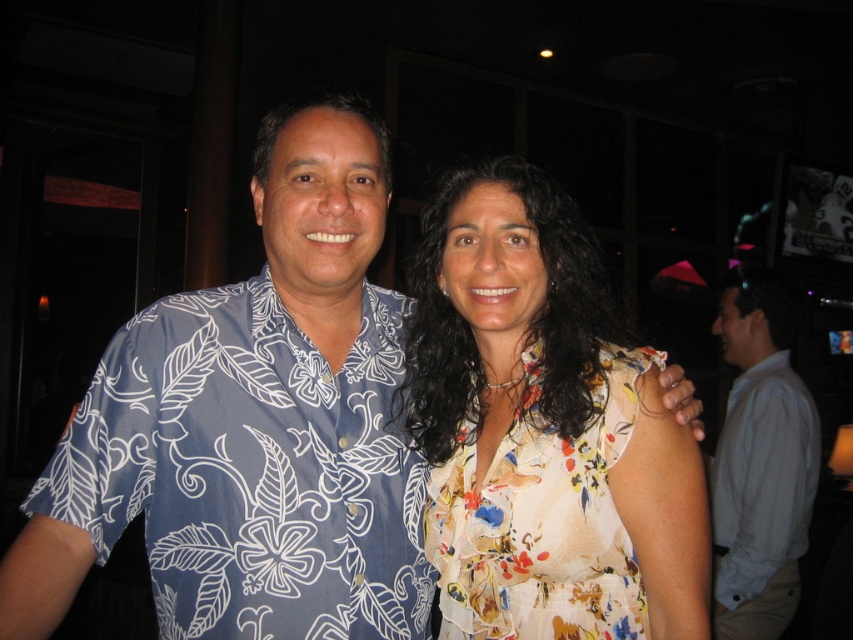
Question: Which object appears closest to the camera in this image?

Choices:
 (A) blue floral-patterned shirt at left
 (B) floral print fabric dress at center
 (C) light blue shirt at right

Answer: (A)

Question: Considering the relative positions of floral print fabric dress at center and light blue shirt at right in the image provided, where is floral print fabric dress at center located with respect to light blue shirt at right?

Choices:
 (A) left
 (B) right

Answer: (A)

Question: Can you confirm if blue floral shirt at center is positioned below blue floral-patterned shirt at left?

Choices:
 (A) no
 (B) yes

Answer: (A)

Question: Among these objects, which one is farthest from the camera?

Choices:
 (A) floral silk blouse at center
 (B) blue floral shirt at center
 (C) light blue shirt at right
 (D) blue floral-patterned shirt at left

Answer: (C)

Question: Does blue floral shirt at center have a larger size compared to floral print fabric dress at center?

Choices:
 (A) no
 (B) yes

Answer: (B)

Question: Considering the real-world distances, which object is closest to the blue floral shirt at center?

Choices:
 (A) floral silk blouse at center
 (B) floral print fabric dress at center

Answer: (A)